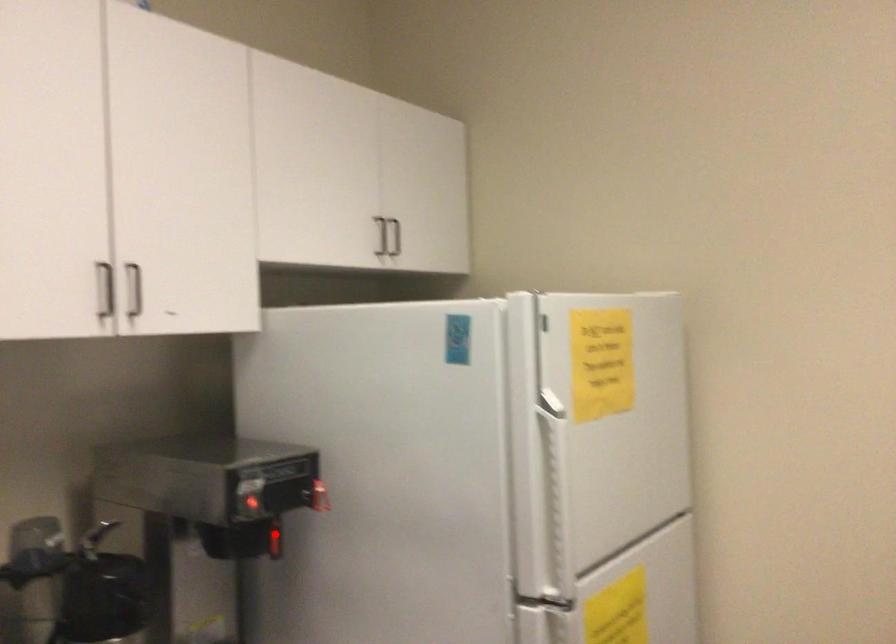
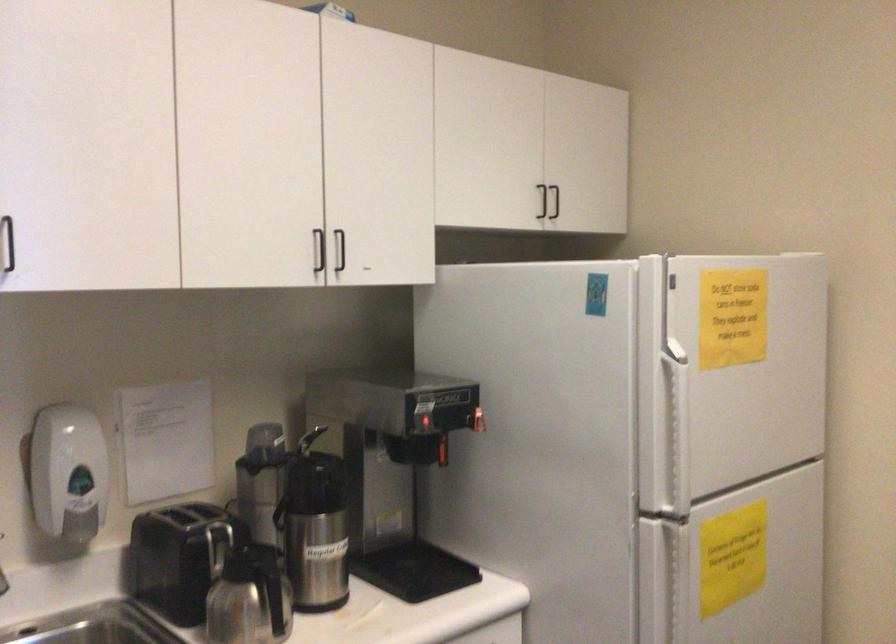
The point at the highlighted location is marked in the first image. Where is the corresponding point in the second image?

(442, 451)